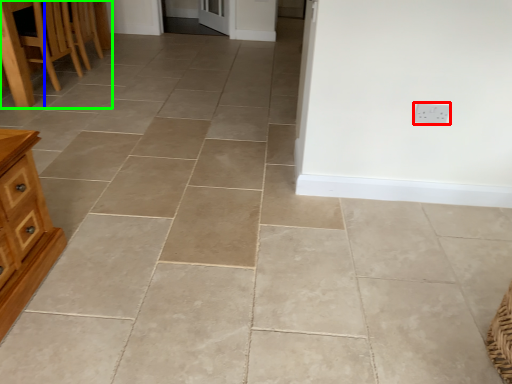
Question: Based on their relative distances, which object is nearer to electric outlet (highlighted by a red box)? Choose from table (highlighted by a blue box) and furniture (highlighted by a green box).

Choices:
 (A) table
 (B) furniture

Answer: (A)